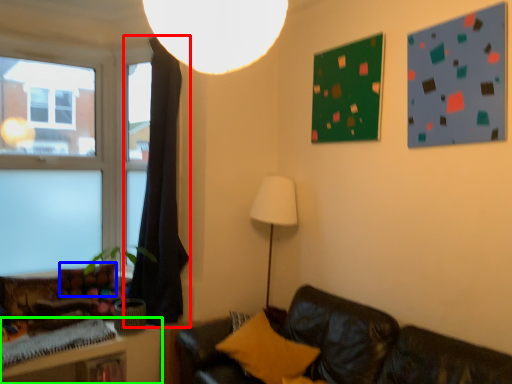
Question: Which object is positioned farthest from curtain (highlighted by a red box)? Select from pillow (highlighted by a blue box) and table (highlighted by a green box).

Choices:
 (A) pillow
 (B) table

Answer: (B)